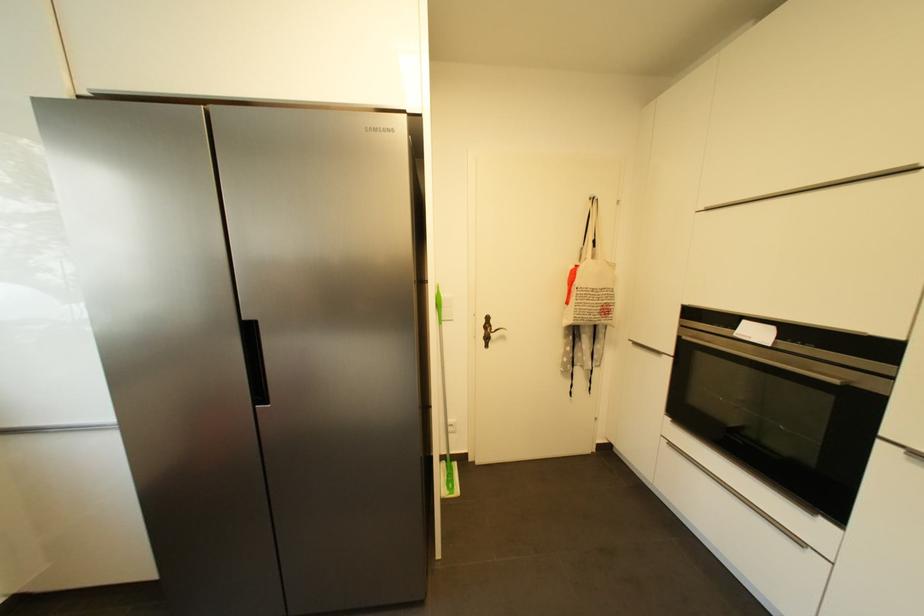
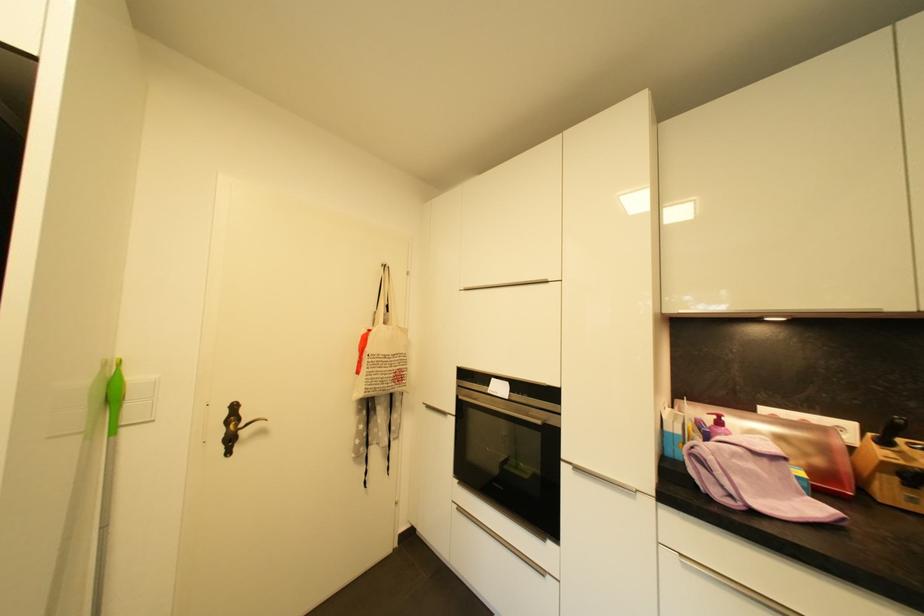
The point at [447,297] is marked in the first image. Where is the corresponding point in the second image?

(138, 379)